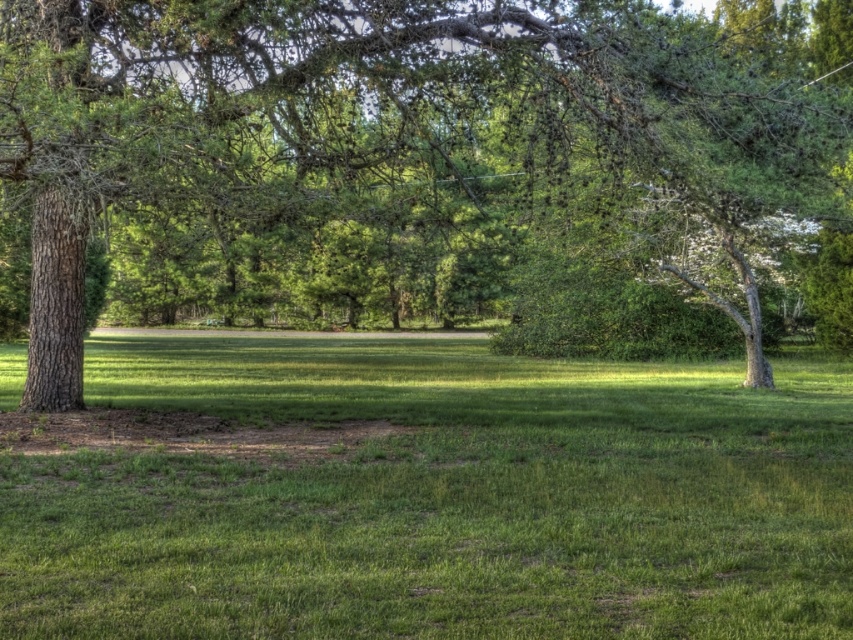
Does green textured tree at left have a smaller size compared to green grassy field at center?

Incorrect, green textured tree at left is not smaller in size than green grassy field at center.

Can you confirm if green textured tree at left is positioned above green grassy field at center?

Correct, green textured tree at left is located above green grassy field at center.

The image size is (853, 640). Describe the element at coordinates (432, 168) in the screenshot. I see `green textured tree at left` at that location.

Identify the location of green textured tree at left. The image size is (853, 640). (432, 168).